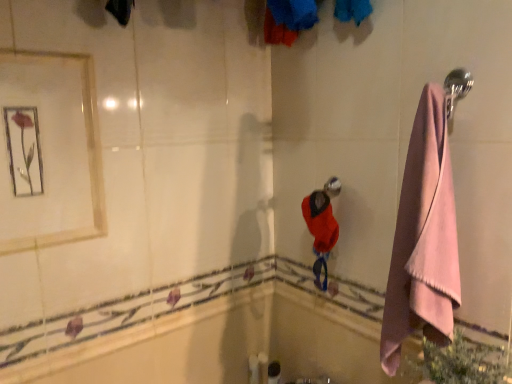
Question: Could you tell me if metallic framed mirror at upper left is turned towards white glossy bath at lower left?

Choices:
 (A) no
 (B) yes

Answer: (A)

Question: Is metallic framed mirror at upper left at the left side of white glossy bath at lower left?

Choices:
 (A) no
 (B) yes

Answer: (B)

Question: From a real-world perspective, is metallic framed mirror at upper left over white glossy bath at lower left?

Choices:
 (A) no
 (B) yes

Answer: (B)

Question: From a real-world perspective, is metallic framed mirror at upper left beneath white glossy bath at lower left?

Choices:
 (A) no
 (B) yes

Answer: (A)

Question: Is metallic framed mirror at upper left surrounding white glossy bath at lower left?

Choices:
 (A) yes
 (B) no

Answer: (B)

Question: Would you say satin silver shower head at center is to the left or to the right of white glossy bath at lower left in the picture?

Choices:
 (A) right
 (B) left

Answer: (A)

Question: Is point (324, 188) positioned closer to the camera than point (184, 329)?

Choices:
 (A) farther
 (B) closer

Answer: (B)

Question: Looking at their shapes, would you say satin silver shower head at center is wider or thinner than white glossy bath at lower left?

Choices:
 (A) wide
 (B) thin

Answer: (A)

Question: From a real-world perspective, relative to white glossy bath at lower left, is satin silver shower head at center vertically above or below?

Choices:
 (A) above
 (B) below

Answer: (A)

Question: From their relative heights in the image, would you say white glossy bath at lower left is taller or shorter than metallic framed mirror at upper left?

Choices:
 (A) tall
 (B) short

Answer: (B)

Question: Is white glossy bath at lower left in front of or behind metallic framed mirror at upper left in the image?

Choices:
 (A) front
 (B) behind

Answer: (B)

Question: From the image's perspective, is white glossy bath at lower left located above or below metallic framed mirror at upper left?

Choices:
 (A) above
 (B) below

Answer: (B)

Question: In terms of width, does white glossy bath at lower left look wider or thinner when compared to metallic framed mirror at upper left?

Choices:
 (A) wide
 (B) thin

Answer: (B)

Question: From a real-world perspective, is satin silver shower head at center physically located above or below metallic framed mirror at upper left?

Choices:
 (A) above
 (B) below

Answer: (B)

Question: Looking at their shapes, would you say satin silver shower head at center is wider or thinner than metallic framed mirror at upper left?

Choices:
 (A) thin
 (B) wide

Answer: (B)